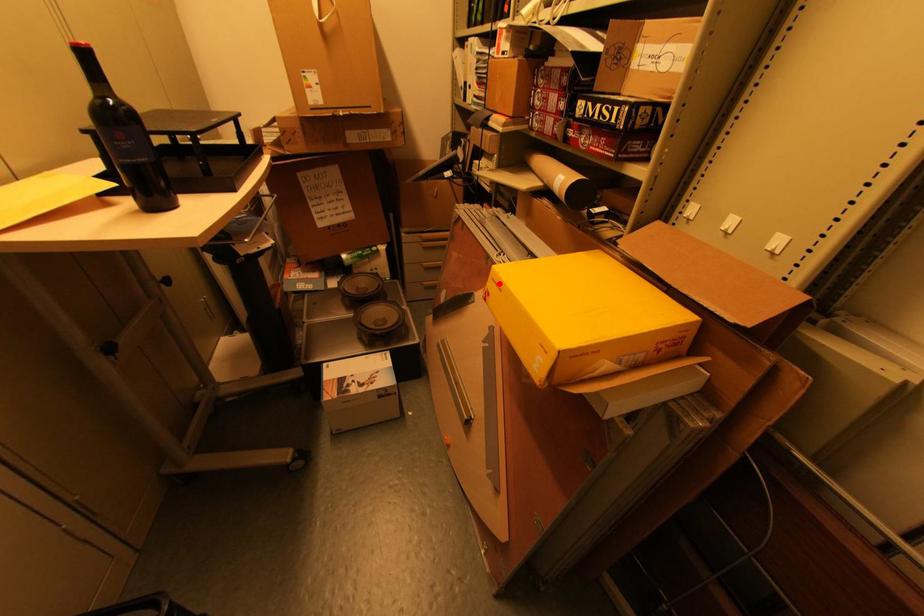
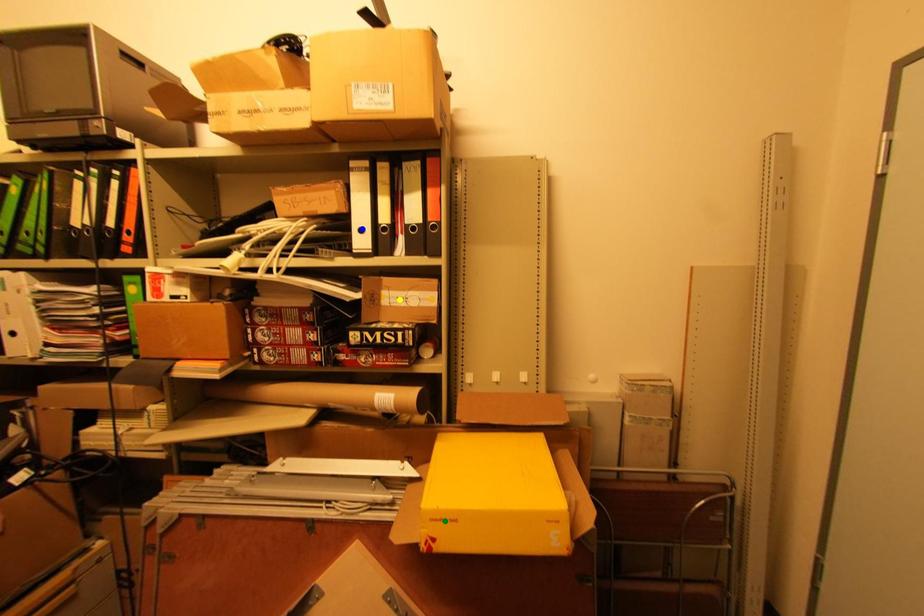
Question: I am providing you with two images of the same scene from different viewpoints. A red point is marked on the first image. You are given multiple points on the second image. Can you choose the point in image 2 that corresponds to the point in image 1?

Choices:
 (A) yellow point
 (B) green point
 (C) blue point

Answer: (B)